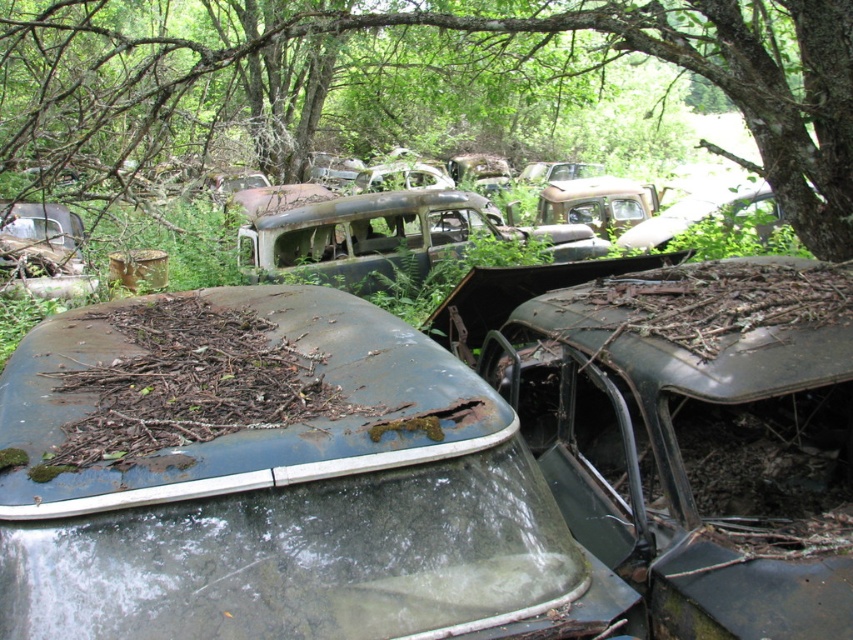
You are a hiker who wants to take a photo of the rusty metal roof at center while standing near the green rough bark tree at upper center. Since the tree is blocking your view, can you move closer to the tree to get a clear shot of the roof?

The green rough bark tree at upper center is bigger than the rusty metal roof at center, so moving closer to the tree might still block your view of the roof. You may need to find another angle or position to capture the roof without obstruction.

You are a park ranger assessing the forest area. You notice the green rough bark tree at upper center and the rusty metal roof at center. Which object has a greater width?

The green rough bark tree at upper center has a greater width than the rusty metal roof at center.